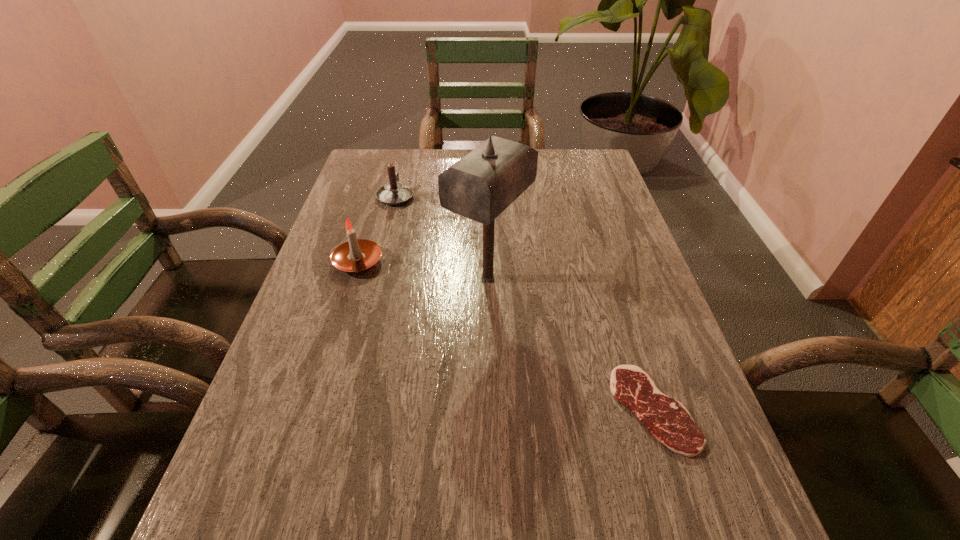
Identify the location of the tallest object. (480, 186).

The width and height of the screenshot is (960, 540). I want to click on mallet, so click(480, 186).

Image resolution: width=960 pixels, height=540 pixels. What are the coordinates of `the taller candle` in the screenshot? It's located at (356, 255).

The image size is (960, 540). I want to click on the third shortest object, so click(x=356, y=255).

The width and height of the screenshot is (960, 540). Find the location of `the farthest object`. the farthest object is located at coordinates (393, 193).

Where is `the shorter candle`? the shorter candle is located at coordinates (393, 193).

I want to click on the nearest object, so click(667, 419).

Where is `the shortest object`? the shortest object is located at coordinates (667, 419).

At what (x,y) coordinates should I click in order to perform the action: click on vacant area located 0.050m on the right of the tallest object. Please return your answer as a coordinate pair (x, y). The width and height of the screenshot is (960, 540). Looking at the image, I should click on (549, 278).

In order to click on free space located on the front of the nearer candle in this screenshot , I will do `click(307, 426)`.